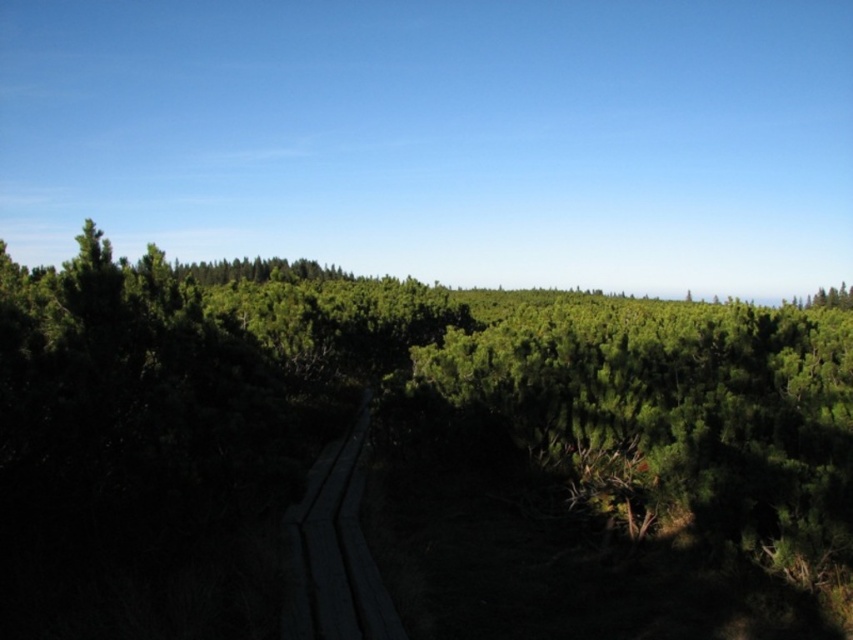
You are standing on the wooden pathway and want to reach the green textured forest at center. Based on the coordinates provided, in which direction should you move relative to your current position?

The green textured forest at center is located at coordinates point (x=410, y=456), so you should move towards the center of the image to reach it.

You are a hiker standing on the dark wood boardwalk at center and want to reach the green textured forest at center. Is the forest directly above the boardwalk? Please explain.

The green textured forest at center is positioned over the dark wood boardwalk at center, so yes, the forest is directly above the boardwalk.